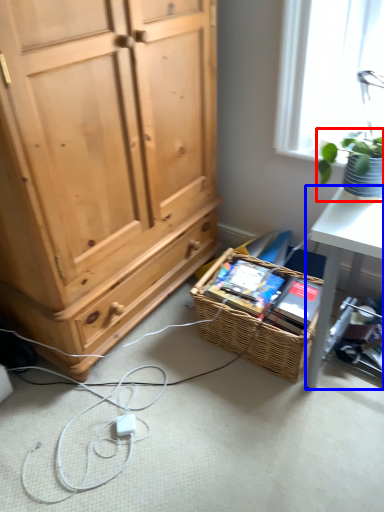
Question: Among these objects, which one is nearest to the camera, houseplant (highlighted by a red box) or desk (highlighted by a blue box)?

Choices:
 (A) houseplant
 (B) desk

Answer: (A)